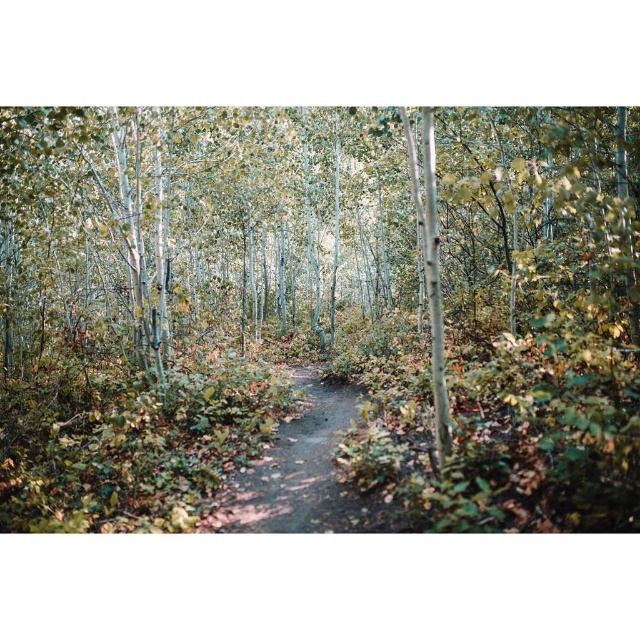
Between green matte path at center and dirt path at center, which one has less height?

dirt path at center is shorter.

Is point (17, 390) more distant than point (317, 387)?

No, it is in front of (317, 387).

Where is `green matte path at center`? This screenshot has width=640, height=640. green matte path at center is located at coordinates (321, 308).